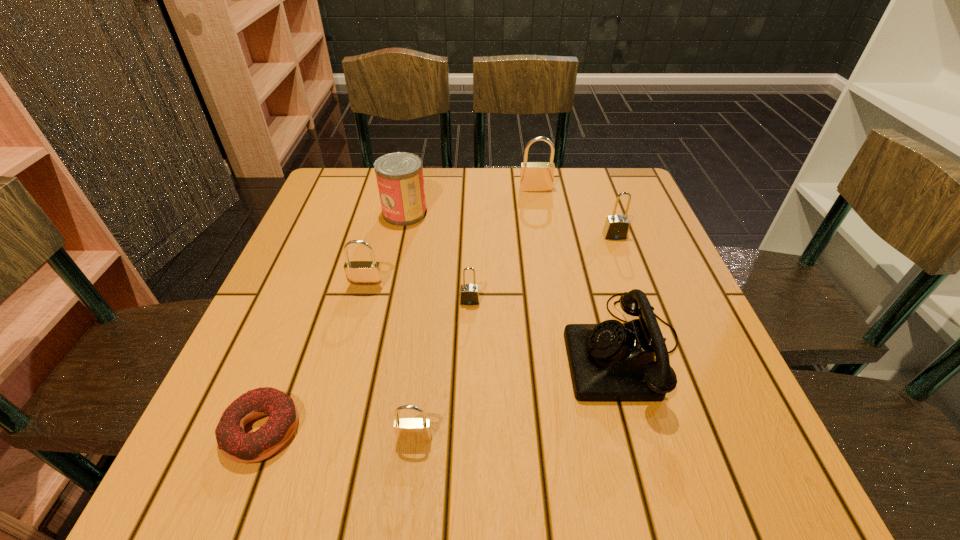
Where is `vacant space located on the front face of the telephone`? vacant space located on the front face of the telephone is located at coordinates (471, 348).

At what (x,y) coordinates should I click in order to perform the action: click on free location located 0.350m on the shackle of the fourth farthest padlock. Please return your answer as a coordinate pair (x, y). Looking at the image, I should click on (x=466, y=487).

The image size is (960, 540). Find the location of `vacant region located 0.320m on the back of the chocolate doughnut`. vacant region located 0.320m on the back of the chocolate doughnut is located at coordinates (324, 268).

Locate an element on the screen. This screenshot has height=540, width=960. padlock located in the far edge section of the desktop is located at coordinates (534, 176).

Image resolution: width=960 pixels, height=540 pixels. I want to click on can present at the far edge, so click(399, 175).

Locate an element on the screen. This screenshot has width=960, height=540. padlock located in the near edge section of the desktop is located at coordinates (407, 430).

What are the coordinates of `doughnut present at the near edge` in the screenshot? It's located at (238, 446).

The image size is (960, 540). Find the location of `padlock that is at the left edge`. padlock that is at the left edge is located at coordinates (360, 274).

Find the location of `doughnut at the left edge`. doughnut at the left edge is located at coordinates (238, 446).

At what (x,y) coordinates should I click in order to perform the action: click on padlock that is at the right edge. Please return your answer as a coordinate pair (x, y). This screenshot has width=960, height=540. Looking at the image, I should click on (616, 227).